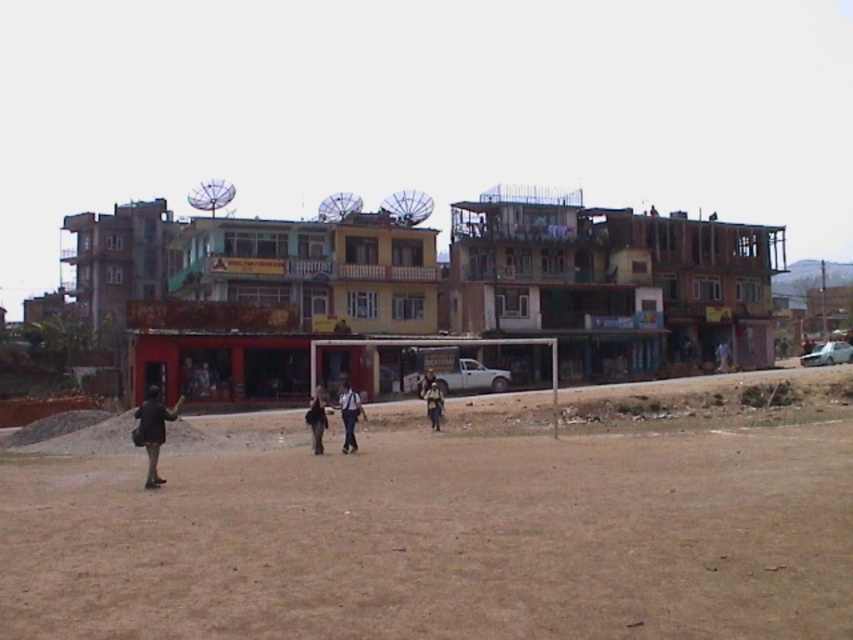
Based on the photo, is brown sandy dirt field at lower center wider than light brown fabric backpack at center?

Yes, brown sandy dirt field at lower center is wider than light brown fabric backpack at center.

Between brown sandy dirt field at lower center and light brown fabric backpack at center, which one has more height?

With more height is brown sandy dirt field at lower center.

Identify the location of brown sandy dirt field at lower center. (451, 522).

Image resolution: width=853 pixels, height=640 pixels. Describe the element at coordinates (451, 522) in the screenshot. I see `brown sandy dirt field at lower center` at that location.

Between point (660, 595) and point (160, 436), which one is positioned behind?

Point (160, 436)

Locate an element on the screen. brown sandy dirt field at lower center is located at coordinates (451, 522).

Between dark brown jacket at lower left and light brown fabric backpack at center, which one appears on the right side from the viewer's perspective?

light brown fabric backpack at center is more to the right.

Is point (146, 419) in front of point (428, 388)?

Yes, it is in front of point (428, 388).

Who is more forward, (155,461) or (428,397)?

Point (155,461) is in front.

Where is `dark brown jacket at lower left`? This screenshot has height=640, width=853. dark brown jacket at lower left is located at coordinates (152, 429).